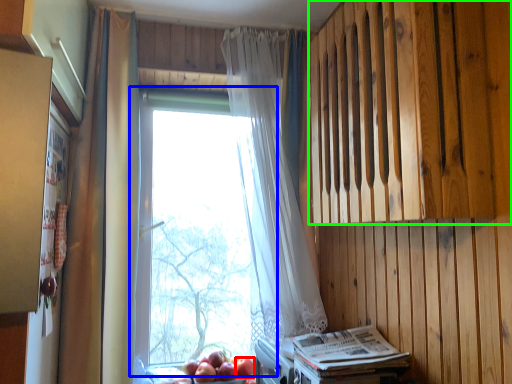
Question: Considering the real-world distances, which object is farthest from apple (highlighted by a red box)? window (highlighted by a blue box) or wood (highlighted by a green box)?

Choices:
 (A) window
 (B) wood

Answer: (B)